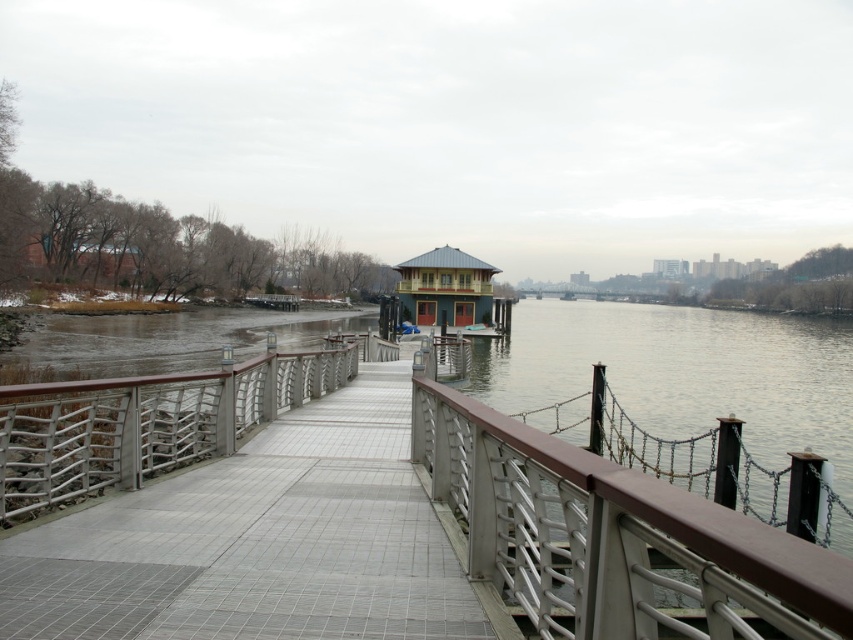
You are a photographer standing at the riverside. You want to capture a photo of the silver metallic railing at center. If your camera can focus on objects within 5 meters, will you need to move closer or farther away to ensure the railing is in focus?

The silver metallic railing at center is 4.28 meters away from the camera, which is within the 5 meters focus range. Therefore, you do not need to move closer or farther away to ensure the railing is in focus.